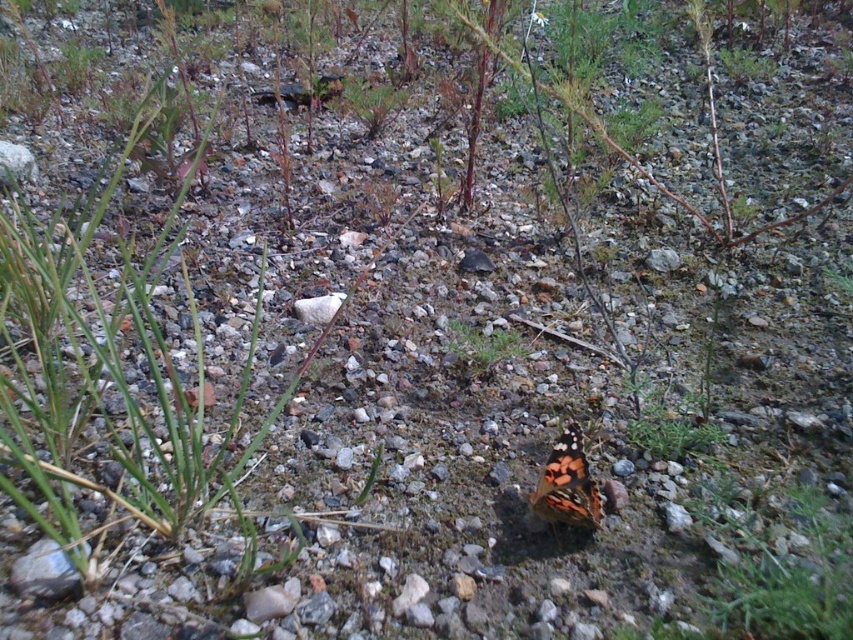
Which is in front, point (579, 502) or point (488, 374)?

Point (579, 502) is more forward.

Looking at this image, can you confirm if multicolored patterned butterfly at center is taller than green leafy plant at center?

Yes.

What do you see at coordinates (567, 484) in the screenshot?
I see `multicolored patterned butterfly at center` at bounding box center [567, 484].

This screenshot has height=640, width=853. What are the coordinates of `multicolored patterned butterfly at center` in the screenshot? It's located at (567, 484).